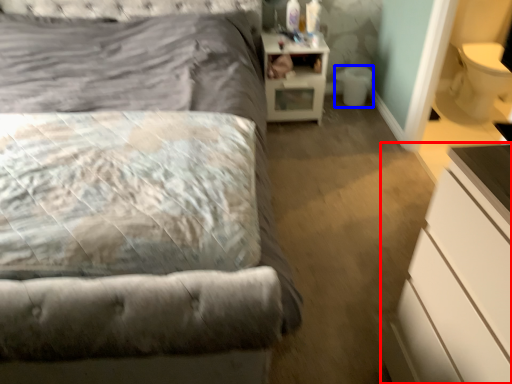
Question: Which object is closer to the camera taking this photo, chest of drawers (highlighted by a red box) or toilet bowl (highlighted by a blue box)?

Choices:
 (A) chest of drawers
 (B) toilet bowl

Answer: (A)